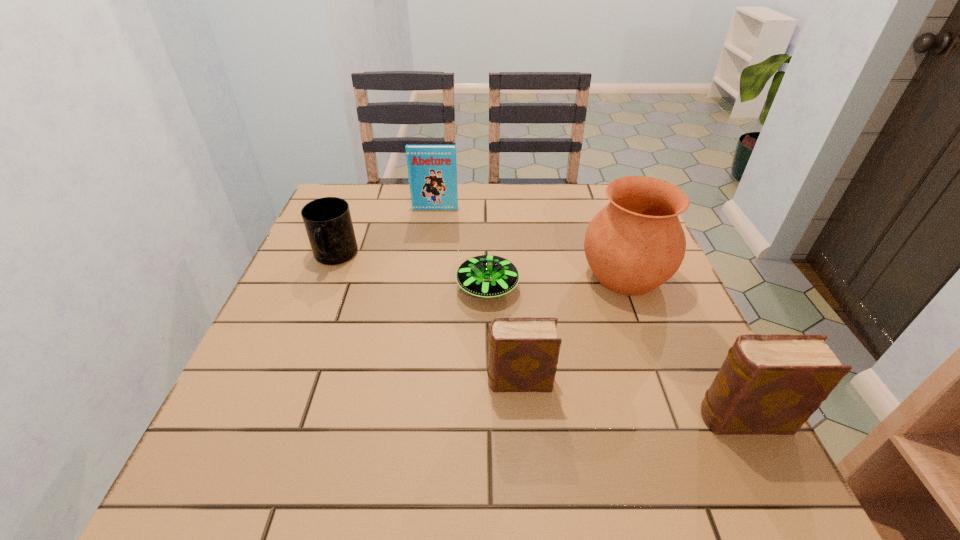
In order to click on free space located on the spine side of the shorter diary in this screenshot , I will do `click(377, 381)`.

Locate an element on the screen. This screenshot has height=540, width=960. free space located on the spine side of the shorter diary is located at coordinates (315, 381).

Locate an element on the screen. The image size is (960, 540). vacant space located on the spine side of the nearer diary is located at coordinates (611, 418).

Find the location of a particular element. The image size is (960, 540). vacant space located on the spine side of the nearer diary is located at coordinates point(476,418).

At what (x,y) coordinates should I click in order to perform the action: click on free space located on the spine side of the nearer diary. Please return your answer as a coordinate pair (x, y). Looking at the image, I should click on (538, 418).

Find the location of a particular element. The image size is (960, 540). free space located 0.310m on the front cover of the second object from left to right is located at coordinates (425, 279).

This screenshot has width=960, height=540. Find the location of `free space located 0.110m on the side of the leftmost object with the handle`. free space located 0.110m on the side of the leftmost object with the handle is located at coordinates (315, 308).

Locate an element on the screen. Image resolution: width=960 pixels, height=540 pixels. vacant space positioned 0.250m on the front of the shortest object is located at coordinates (490, 406).

At what (x,y) coordinates should I click in order to perform the action: click on free space located on the back of the pottery. Please return your answer as a coordinate pair (x, y). Looking at the image, I should click on (610, 234).

At what (x,y) coordinates should I click in order to perform the action: click on object positioned at the far edge. Please return your answer as a coordinate pair (x, y). The width and height of the screenshot is (960, 540). Looking at the image, I should click on (432, 170).